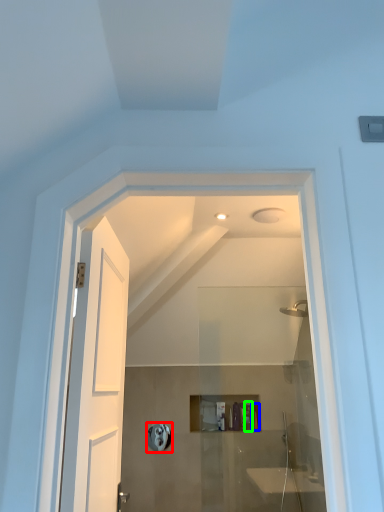
Question: Which object is positioned closest to towel bar (highlighted by a red box)? Select from toiletry (highlighted by a blue box) and toiletry (highlighted by a green box).

Choices:
 (A) toiletry
 (B) toiletry

Answer: (B)